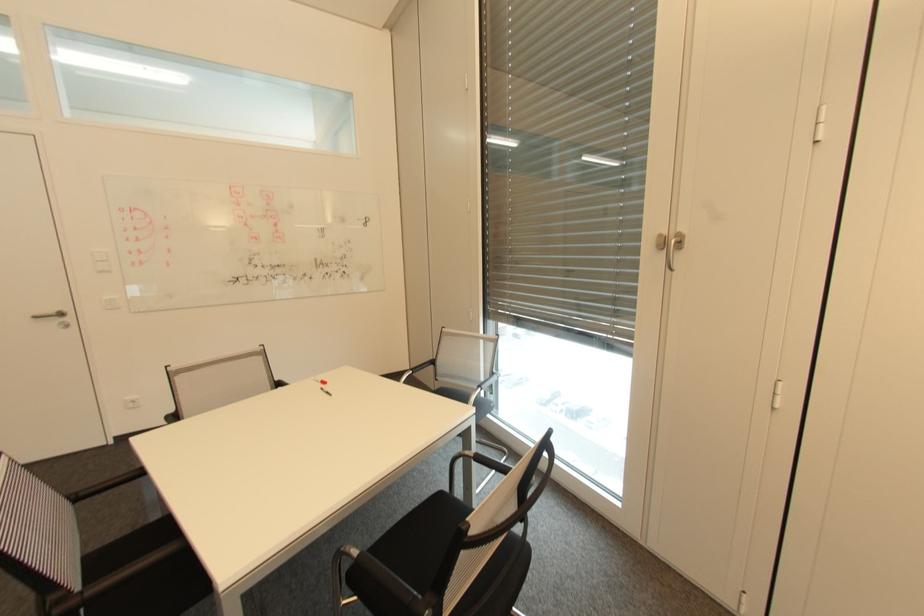
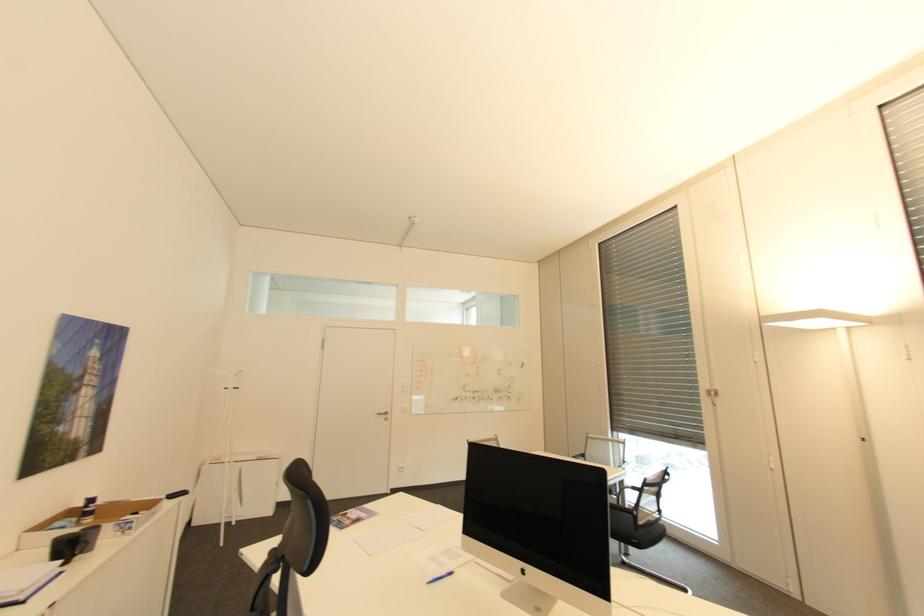
Find the pixel in the second image that matches pixel 669 232 in the first image.

(713, 387)